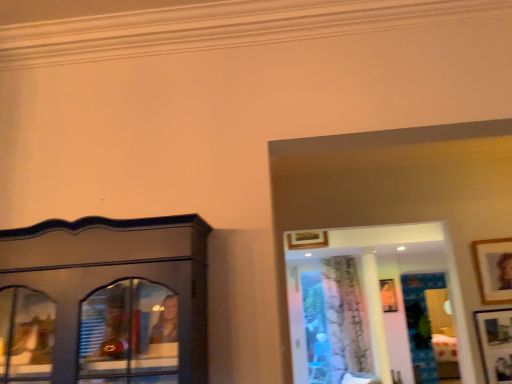
Question: Considering the relative sizes of wooden picture frame at upper center, which ranks as the third picture frame in bottom-to-top order, and wooden picture frame at upper right, arranged as the second picture frame when viewed from the front, in the image provided, is wooden picture frame at upper center, which ranks as the third picture frame in bottom-to-top order, taller than wooden picture frame at upper right, arranged as the second picture frame when viewed from the front,?

Choices:
 (A) yes
 (B) no

Answer: (B)

Question: Does wooden picture frame at upper center, which appears as the second picture frame when viewed from the top, appear on the right side of wooden picture frame at upper right, arranged as the second picture frame when viewed from the front?

Choices:
 (A) yes
 (B) no

Answer: (B)

Question: Is wooden picture frame at upper center, which ranks as the third picture frame in bottom-to-top order, shorter than wooden picture frame at upper right, which ranks as the fourth picture frame in bottom-to-top order?

Choices:
 (A) no
 (B) yes

Answer: (B)

Question: From a real-world perspective, is wooden picture frame at upper center, which appears as the 2th picture frame when viewed from the back, positioned under wooden picture frame at upper right, arranged as the second picture frame when viewed from the front, based on gravity?

Choices:
 (A) yes
 (B) no

Answer: (B)

Question: Does wooden picture frame at upper center, which ranks as the third picture frame in bottom-to-top order, turn towards wooden picture frame at upper right, which is the 3th picture frame from back to front?

Choices:
 (A) no
 (B) yes

Answer: (A)

Question: Does wooden picture frame at upper center, the 3th picture frame in the front-to-back sequence, have a larger size compared to wooden picture frame at upper right, which is the 3th picture frame from back to front?

Choices:
 (A) yes
 (B) no

Answer: (B)

Question: Is wooden picture frame at upper center, the first picture frame when ordered from left to right, located outside white sheer curtain at center?

Choices:
 (A) yes
 (B) no

Answer: (A)

Question: Does wooden picture frame at upper center, which is counted as the fourth picture frame, starting from the right, come behind white sheer curtain at center?

Choices:
 (A) no
 (B) yes

Answer: (A)

Question: Is white sheer curtain at center surrounded by wooden picture frame at upper center, which is counted as the fourth picture frame, starting from the right?

Choices:
 (A) no
 (B) yes

Answer: (A)

Question: Does wooden picture frame at upper center, which ranks as the third picture frame in bottom-to-top order, have a lesser height compared to white sheer curtain at center?

Choices:
 (A) no
 (B) yes

Answer: (B)

Question: Does wooden picture frame at upper center, which ranks as the third picture frame in bottom-to-top order, come in front of white sheer curtain at center?

Choices:
 (A) yes
 (B) no

Answer: (A)

Question: Does wooden picture frame at upper center, which appears as the 2th picture frame when viewed from the back, turn towards white sheer curtain at center?

Choices:
 (A) no
 (B) yes

Answer: (A)

Question: Is white sheer curtain at center oriented away from wooden picture frame at lower right, placed as the first picture frame when sorted from front to back?

Choices:
 (A) no
 (B) yes

Answer: (A)